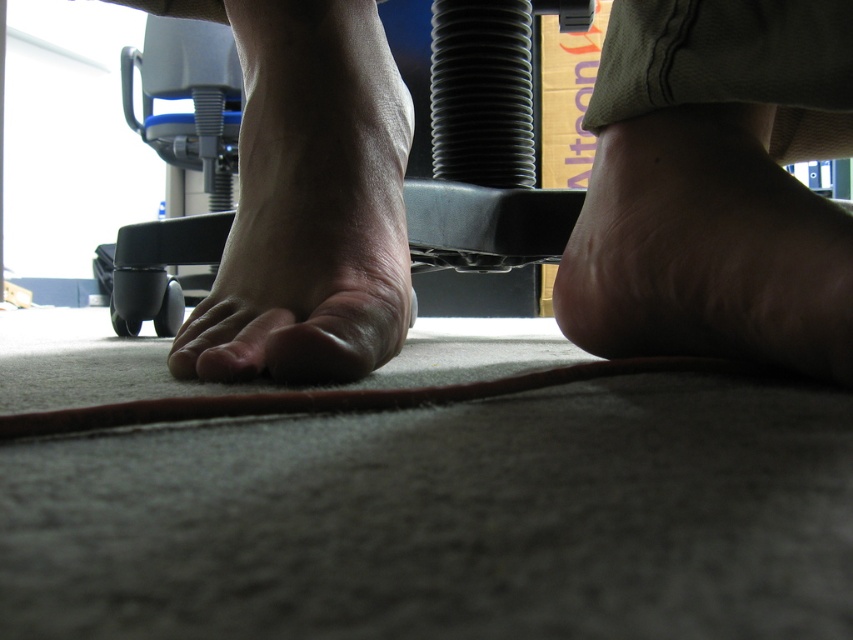
Question: Is matte skin toe at center below pink flesh at center?

Choices:
 (A) no
 (B) yes

Answer: (A)

Question: From the image, what is the correct spatial relationship of black plastic chair at center in relation to matte skin toe at center?

Choices:
 (A) below
 (B) above

Answer: (B)

Question: Which is nearer to the skinny barefoot at lower left?

Choices:
 (A) pink flesh at center
 (B) matte skin toe at center

Answer: (B)

Question: Does skinny flesh-toned foot at lower right have a lesser width compared to black plastic chair at center?

Choices:
 (A) no
 (B) yes

Answer: (B)

Question: Based on their relative distances, which object is farther from the matte skin toe at center?

Choices:
 (A) black plastic chair at center
 (B) pink flesh at center
 (C) skinny barefoot at lower left
 (D) skinny flesh-toned foot at lower right

Answer: (A)

Question: Which point is closer to the camera taking this photo?

Choices:
 (A) (233, 352)
 (B) (514, 20)
 (C) (676, 236)

Answer: (C)